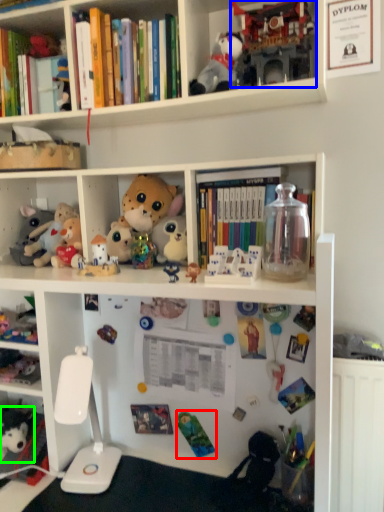
Question: Which object is positioned farthest from toy (highlighted by a red box)? Select from toy (highlighted by a blue box) and toy (highlighted by a green box).

Choices:
 (A) toy
 (B) toy

Answer: (A)